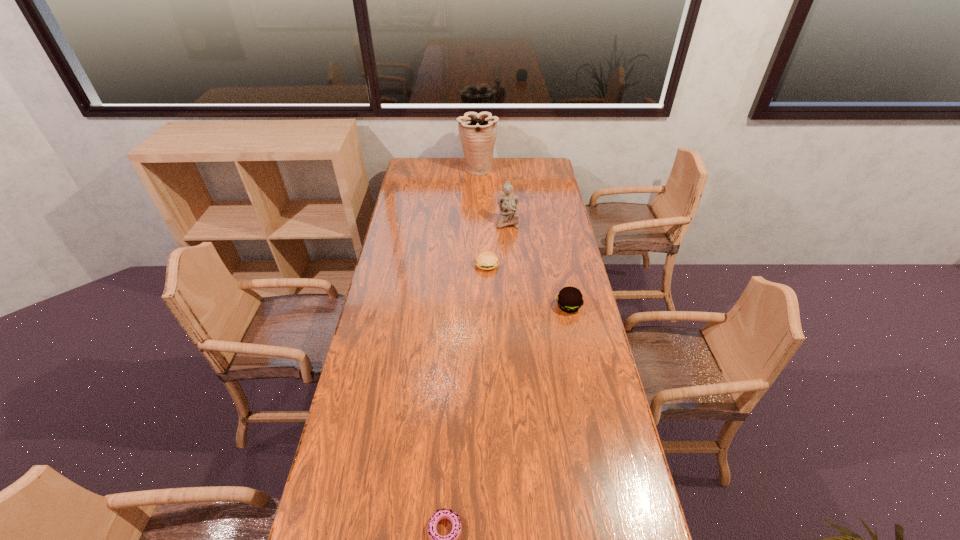
Image resolution: width=960 pixels, height=540 pixels. In order to click on the farthest object in this screenshot , I will do [478, 132].

What are the coordinates of `the tallest object` in the screenshot? It's located at (478, 132).

You are a GUI agent. You are given a task and a screenshot of the screen. Output one action in this format:
    pyautogui.click(x=<x>, y=<y>)
    Task: Click on the second tallest object
    Image resolution: width=960 pixels, height=540 pixels.
    Given the screenshot: What is the action you would take?
    pyautogui.click(x=508, y=203)

Locate an element on the screen. This screenshot has height=540, width=960. the fourth nearest object is located at coordinates (508, 203).

The height and width of the screenshot is (540, 960). I want to click on the nearer patty, so click(x=569, y=299).

Where is `the taller patty`? the taller patty is located at coordinates (569, 299).

Where is `the left patty`? The width and height of the screenshot is (960, 540). the left patty is located at coordinates (486, 260).

Find the location of `the farther patty`. the farther patty is located at coordinates (486, 260).

The image size is (960, 540). What are the coordinates of `free space located 0.070m on the left of the urn` in the screenshot? It's located at (445, 169).

At what (x,y) coordinates should I click in order to perform the action: click on free space located 0.330m on the front-facing side of the figurine. Please return your answer as a coordinate pair (x, y). Looking at the image, I should click on (512, 275).